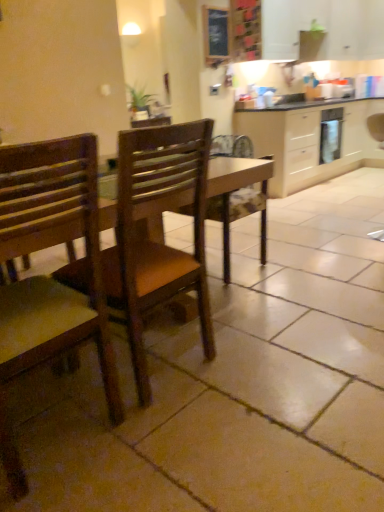
Where is `vacant space in between wooden chair at center, the second chair positioned from the left, and wooden chair at left, the first chair when ordered from left to right`? This screenshot has height=512, width=384. vacant space in between wooden chair at center, the second chair positioned from the left, and wooden chair at left, the first chair when ordered from left to right is located at coordinates (104, 399).